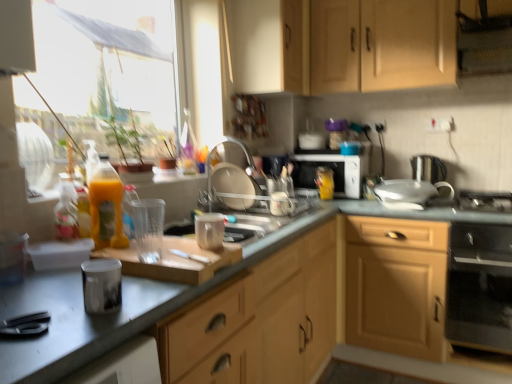
The image size is (512, 384). Find the location of `matte white cup at center, the fourth appliance positioned from the right`. matte white cup at center, the fourth appliance positioned from the right is located at coordinates (209, 231).

This screenshot has height=384, width=512. I want to click on translucent yellow bottle at left, so click(106, 206).

The height and width of the screenshot is (384, 512). Describe the element at coordinates (106, 206) in the screenshot. I see `translucent yellow bottle at left` at that location.

Where is `black glass oven at right`? The height and width of the screenshot is (384, 512). black glass oven at right is located at coordinates (480, 287).

What do you see at coordinates (281, 204) in the screenshot? I see `white glossy cup at center, which is the 3th appliance from right to left` at bounding box center [281, 204].

Identify the location of light wood cabinet at lower right, positioned as the 3th cabinetry in top-to-bottom order. The width and height of the screenshot is (512, 384). (396, 286).

Where is `matte white cup at center, the third appliance from the front`? This screenshot has height=384, width=512. matte white cup at center, the third appliance from the front is located at coordinates (209, 231).

Consider the image. Do you think light wood cabinet at upper center, positioned as the second cabinetry in top-to-bottom order, is within transparent glass window at upper left, or outside of it?

light wood cabinet at upper center, positioned as the second cabinetry in top-to-bottom order, lies outside transparent glass window at upper left.

Who is taller, light wood cabinet at upper center, positioned as the second cabinetry in top-to-bottom order, or transparent glass window at upper left?

Standing taller between the two is light wood cabinet at upper center, positioned as the second cabinetry in top-to-bottom order.

Can you confirm if light wood cabinet at upper center, positioned as the second cabinetry in top-to-bottom order, is bigger than transparent glass window at upper left?

Yes.

Visually, is light wood cabinet at upper center, which ranks as the 2th cabinetry in bottom-to-top order, positioned to the left or to the right of transparent glass window at upper left?

From the image, it's evident that light wood cabinet at upper center, which ranks as the 2th cabinetry in bottom-to-top order, is to the right of transparent glass window at upper left.

Based on the photo, in the image, is shiny metallic mug at left, which is the 7th appliance from right to left, on the left side or the right side of white glossy cup at center, which is the 3th appliance from right to left?

Based on their positions, shiny metallic mug at left, which is the 7th appliance from right to left, is located to the left of white glossy cup at center, which is the 3th appliance from right to left.

How many degrees apart are the facing directions of shiny metallic mug at left, which is the 1th appliance in front-to-back order, and white glossy cup at center, which is the 3th appliance from right to left?

There is a 56.2-degree angle between the facing directions of shiny metallic mug at left, which is the 1th appliance in front-to-back order, and white glossy cup at center, which is the 3th appliance from right to left.

Is shiny metallic mug at left, which appears as the seventh appliance when viewed from the back, facing away from white glossy cup at center, which is the 3th appliance from right to left?

No, shiny metallic mug at left, which appears as the seventh appliance when viewed from the back,'s orientation is not away from white glossy cup at center, which is the 3th appliance from right to left.

From the image's perspective, is translucent yellow bottle at left located beneath smooth gray countertop at center?

Actually, translucent yellow bottle at left appears above smooth gray countertop at center in the image.

Where is `countertop in front of the translucent yellow bottle at left`? countertop in front of the translucent yellow bottle at left is located at coordinates (146, 298).

Choose the correct answer: Is translucent yellow bottle at left inside smooth gray countertop at center or outside it?

translucent yellow bottle at left is located beyond the bounds of smooth gray countertop at center.

Looking at this image, from a real-world perspective, which object stands above the other?

matte white cup at center, the fourth appliance positioned from the right, from a real-world perspective.

Considering the relative sizes of white glossy sink at center, positioned as the 7th appliance in left-to-right order, and matte white cup at center, placed as the fourth appliance when sorted from left to right, in the image provided, is white glossy sink at center, positioned as the 7th appliance in left-to-right order, taller than matte white cup at center, placed as the fourth appliance when sorted from left to right,?

Indeed, white glossy sink at center, positioned as the 7th appliance in left-to-right order, has a greater height compared to matte white cup at center, placed as the fourth appliance when sorted from left to right.

Which object is further away from the camera, white glossy sink at center, the sixth appliance from the front, or matte white cup at center, the fourth appliance positioned from the right?

white glossy sink at center, the sixth appliance from the front.

Considering the points (422, 185) and (214, 225), which point is behind, point (422, 185) or point (214, 225)?

The point (422, 185) is more distant.

From the image's perspective, is shiny metallic mug at left, which is the 7th appliance from right to left, located above black matte gas stove at right?

No, from the image's perspective, shiny metallic mug at left, which is the 7th appliance from right to left, is not over black matte gas stove at right.

Considering the relative sizes of shiny metallic mug at left, which is the 7th appliance from right to left, and black matte gas stove at right in the image provided, is shiny metallic mug at left, which is the 7th appliance from right to left, smaller than black matte gas stove at right?

Correct, shiny metallic mug at left, which is the 7th appliance from right to left, occupies less space than black matte gas stove at right.

Considering the sizes of shiny metallic mug at left, the first appliance viewed from the left, and black matte gas stove at right in the image, is shiny metallic mug at left, the first appliance viewed from the left, taller or shorter than black matte gas stove at right?

shiny metallic mug at left, the first appliance viewed from the left, is taller than black matte gas stove at right.

Consider the image. Is black matte gas stove at right located within shiny metallic mug at left, the first appliance viewed from the left?

No, black matte gas stove at right is not surrounded by shiny metallic mug at left, the first appliance viewed from the left.

Between transparent glass window at upper left and light wood cabinet at upper center, which ranks as the 2th cabinetry in bottom-to-top order, which one has larger size?

light wood cabinet at upper center, which ranks as the 2th cabinetry in bottom-to-top order, is bigger.

Is transparent glass window at upper left outside of light wood cabinet at upper center, which ranks as the 2th cabinetry in bottom-to-top order?

Yes, transparent glass window at upper left is not within light wood cabinet at upper center, which ranks as the 2th cabinetry in bottom-to-top order.

I want to click on window located on the left of light wood cabinet at upper center, positioned as the second cabinetry in top-to-bottom order, so click(106, 62).

From a real-world perspective, is transparent glass window at upper left physically above light wood cabinet at upper center, positioned as the second cabinetry in top-to-bottom order?

No, from a real-world perspective, transparent glass window at upper left is not over light wood cabinet at upper center, positioned as the second cabinetry in top-to-bottom order

Can you confirm if matte white cup at center, the fifth appliance when ordered from back to front, is wider than smooth gray countertop at center?

Incorrect, the width of matte white cup at center, the fifth appliance when ordered from back to front, does not surpass that of smooth gray countertop at center.

From a real-world perspective, is matte white cup at center, the fifth appliance when ordered from back to front, positioned above or below smooth gray countertop at center?

In terms of real-world spatial position, matte white cup at center, the fifth appliance when ordered from back to front, is above smooth gray countertop at center.

At what (x,y) coordinates should I click in order to perform the action: click on appliance that is the 2nd object located above the smooth gray countertop at center (from the image's perspective). Please return your answer as a coordinate pair (x, y). The image size is (512, 384). Looking at the image, I should click on (209, 231).

Considering the relative sizes of matte white cup at center, the third appliance from the front, and smooth gray countertop at center in the image provided, is matte white cup at center, the third appliance from the front, smaller than smooth gray countertop at center?

Correct, matte white cup at center, the third appliance from the front, occupies less space than smooth gray countertop at center.

Locate an element on the screen. cabinetry that is the 2nd object to the right of the transparent glass window at upper left, starting at the anchor is located at coordinates (339, 45).

Locate an element on the screen. This screenshot has height=384, width=512. the 4th appliance to the left of the white glossy cup at center, arranged as the 3th appliance when viewed from the back, counting from the anchor's position is located at coordinates (102, 285).

Estimate the real-world distances between objects in this image. Which object is closer to white glossy sink at center, which appears as the second appliance when viewed from the back, transparent glass window at upper left or black glass oven at right?

black glass oven at right is closer to white glossy sink at center, which appears as the second appliance when viewed from the back.

Based on their spatial positions, is transparent glass window at upper left or clear plastic dish rack at center, which is the fourth appliance in front-to-back order, further from white matte microwave at center, which is the second appliance in right-to-left order?

transparent glass window at upper left is positioned further to the anchor white matte microwave at center, which is the second appliance in right-to-left order.

From the image, which object appears to be nearer to matte plastic bottle at center, white glossy cup at center, which is the 5th appliance in left-to-right order, or shiny metallic mug at left, which appears as the seventh appliance when viewed from the back?

white glossy cup at center, which is the 5th appliance in left-to-right order, is closer to matte plastic bottle at center.

Looking at the image, which one is located further to matte white cup at center, placed as the fourth appliance when sorted from left to right, metallic silver exhaust hood at upper right or matte wood cabinet at upper center, the 3th cabinetry in the bottom-to-top sequence?

metallic silver exhaust hood at upper right is positioned further to the anchor matte white cup at center, placed as the fourth appliance when sorted from left to right.

Looking at the image, which one is located further to matte plastic bottle at center, shiny metallic mug at left, which is the 1th appliance in front-to-back order, or white glossy sink at center, the sixth appliance from the front?

shiny metallic mug at left, which is the 1th appliance in front-to-back order, is positioned further to the anchor matte plastic bottle at center.

Looking at the image, which one is located further to white matte microwave at center, which is the second appliance in right-to-left order, translucent yellow bottle at left or metallic silver exhaust hood at upper right?

Among the two, translucent yellow bottle at left is located further to white matte microwave at center, which is the second appliance in right-to-left order.

Based on the photo, from the image, which object appears to be farther from black glass oven at right, white glossy sink at center, the sixth appliance from the front, or metallic silver exhaust hood at upper right?

metallic silver exhaust hood at upper right is further to black glass oven at right.

Based on their spatial positions, is white glossy cup at center, which is the 3th appliance from right to left, or matte white cup at center, the fourth appliance positioned from the right, further from black matte gas stove at right?

matte white cup at center, the fourth appliance positioned from the right.

Identify the location of kitchen appliance between clear plastic dish rack at center, the 3th appliance when ordered from left to right, and black matte gas stove at right, in the horizontal direction. The width and height of the screenshot is (512, 384). (480, 287).

The width and height of the screenshot is (512, 384). I want to click on gas stove between matte wood cabinet at upper center, which is the 1th cabinetry from top to bottom, and light wood cabinet at lower right, positioned as the 3th cabinetry in top-to-bottom order, in the up-down direction, so click(485, 201).

Locate an element on the screen. bottle between transparent glass window at upper left and transparent plastic glass at center, marked as the sixth appliance in a right-to-left arrangement, in the vertical direction is located at coordinates (106, 206).

Where is `kitchen appliance positioned between smooth gray countertop at center and white matte microwave at center, which is counted as the 6th appliance, starting from the left, from near to far`? The height and width of the screenshot is (384, 512). kitchen appliance positioned between smooth gray countertop at center and white matte microwave at center, which is counted as the 6th appliance, starting from the left, from near to far is located at coordinates (480, 287).